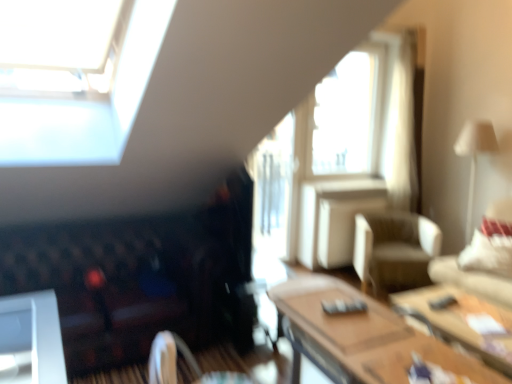
This screenshot has width=512, height=384. In order to click on free space above wooden table at center, acting as the first table starting from the front (from a real-world perspective) in this screenshot , I will do `click(370, 333)`.